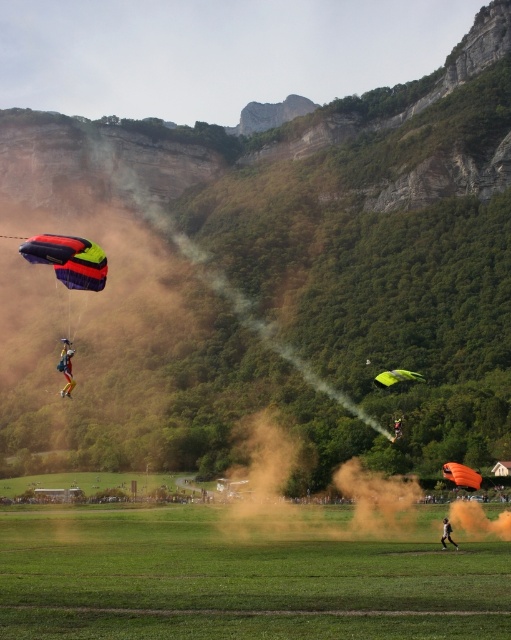
Question: Does multicolored fabric parachute at left appear over orange fabric parachute at lower right?

Choices:
 (A) no
 (B) yes

Answer: (B)

Question: Which point is farther to the camera?

Choices:
 (A) yellow fabric parachute at left
 (B) green grass field at lower center
 (C) orange matte parachute at lower right

Answer: (C)

Question: Among these objects, which one is nearest to the camera?

Choices:
 (A) multicolored fabric parachute at left
 (B) yellow fabric parachute at left
 (C) orange matte parachute at lower right
 (D) orange fabric parachute at center

Answer: (A)

Question: Which object is positioned closest to the yellow fabric parachute at left?

Choices:
 (A) orange fabric parachute at center
 (B) multicolored fabric parachute at left
 (C) orange fabric parachute at lower right

Answer: (B)

Question: Does orange matte parachute at lower right have a greater width compared to green matte parachute at center?

Choices:
 (A) yes
 (B) no

Answer: (B)

Question: Is green grass field at lower center in front of orange matte parachute at lower right?

Choices:
 (A) no
 (B) yes

Answer: (B)